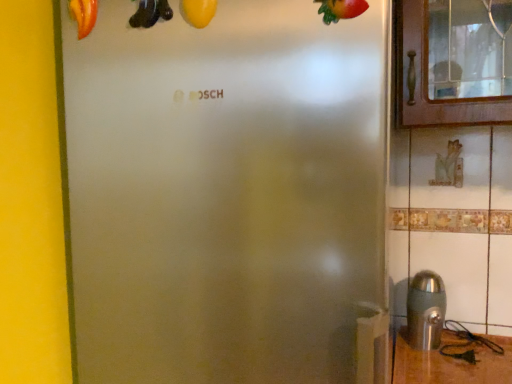
Question: Considering their positions, is matte red tomato at upper left, which is the third fruit from right to left, located in front of or behind stainless steel at lower right?

Choices:
 (A) behind
 (B) front

Answer: (B)

Question: Visually, is matte red tomato at upper left, which is counted as the first fruit, starting from the back, positioned to the left or to the right of stainless steel at lower right?

Choices:
 (A) left
 (B) right

Answer: (A)

Question: Which of these objects is positioned closest to the stainless steel at lower right?

Choices:
 (A) yellow matte squash at upper center, the 2th fruit in the left-to-right sequence
 (B) yellow matte banana at upper center
 (C) shiny red strawberry at upper right, which is the 3th fruit from left to right
 (D) matte red tomato at upper left, which is counted as the first fruit, starting from the back

Answer: (C)

Question: Which is nearer to the yellow matte banana at upper center?

Choices:
 (A) shiny red strawberry at upper right, which ranks as the 1th fruit in front-to-back order
 (B) stainless steel at lower right
 (C) yellow matte squash at upper center, positioned as the 2th fruit in back-to-front order
 (D) matte red tomato at upper left, which is counted as the first fruit, starting from the back

Answer: (C)